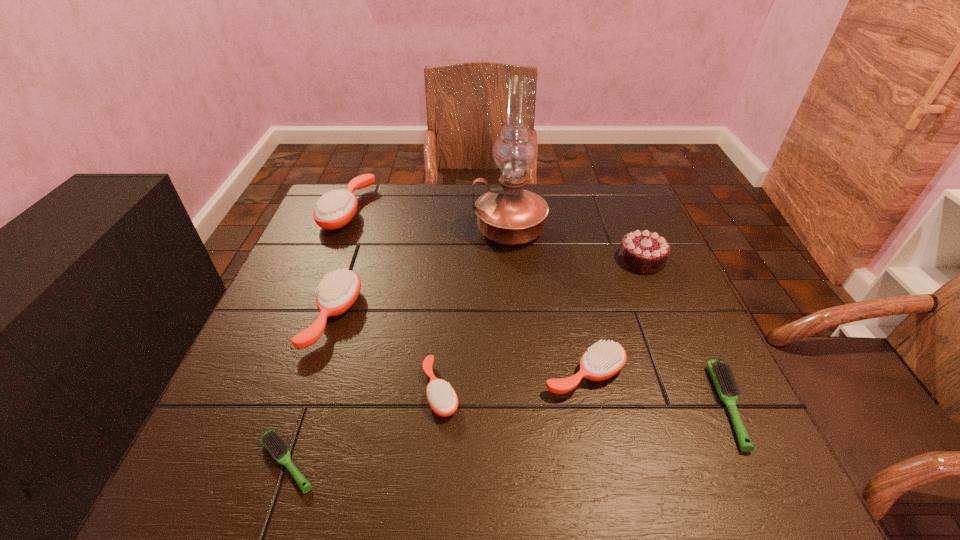
Identify the location of the second shortest object. The height and width of the screenshot is (540, 960). (722, 375).

Where is `the second shortest hairbrush`? The height and width of the screenshot is (540, 960). the second shortest hairbrush is located at coordinates (722, 375).

Locate an element on the screen. The image size is (960, 540). the smaller light hairbrush is located at coordinates (272, 441).

Identify the location of the shortest hairbrush. (272, 441).

At what (x,y) coordinates should I click in order to perform the action: click on free space located 0.350m on the front of the oil lamp. Please return your answer as a coordinate pair (x, y). The width and height of the screenshot is (960, 540). Looking at the image, I should click on (520, 362).

You are a GUI agent. You are given a task and a screenshot of the screen. Output one action in this format:
    pyautogui.click(x=<x>, y=<y>)
    Task: Click on the vacant region located 0.230m on the front of the farthest orange hairbrush
    
    Given the screenshot: What is the action you would take?
    pyautogui.click(x=313, y=296)

Find the location of `free region located 0.070m on the back of the chocolate cake`. free region located 0.070m on the back of the chocolate cake is located at coordinates (629, 230).

Where is `free spot located 0.200m on the front of the second biggest orange hairbrush`? This screenshot has width=960, height=540. free spot located 0.200m on the front of the second biggest orange hairbrush is located at coordinates (289, 450).

Find the location of a particular element. The width and height of the screenshot is (960, 540). free region located on the left of the fifth hairbrush from left to right is located at coordinates (441, 374).

This screenshot has width=960, height=540. In order to click on free space located on the back of the third orange hairbrush from left to right in this screenshot , I will do `click(444, 339)`.